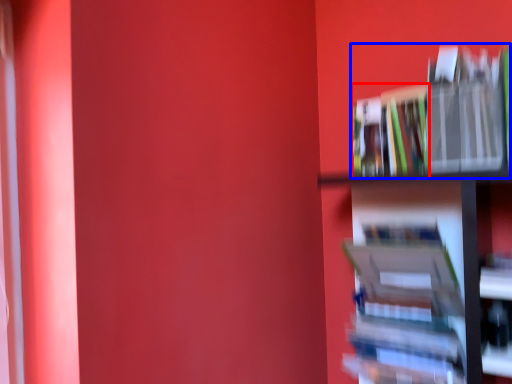
Question: Which object appears closest to the camera in this image, book (highlighted by a red box) or book (highlighted by a blue box)?

Choices:
 (A) book
 (B) book

Answer: (B)